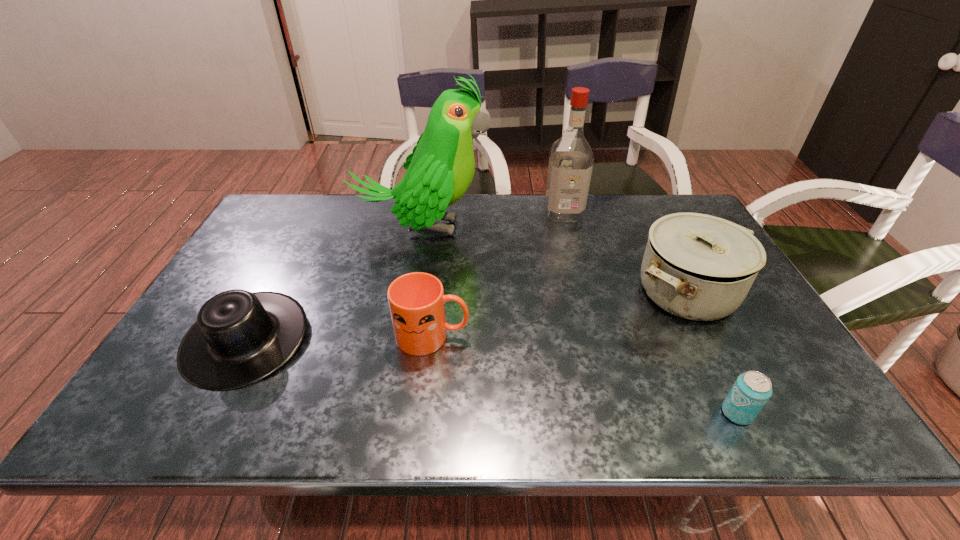
What are the coordinates of `free space located on the handle side of the mug` in the screenshot? It's located at (587, 336).

The image size is (960, 540). Identify the location of blank space located 0.280m on the right of the leftmost object. (424, 339).

Find the location of a particular element. free region located 0.160m on the left of the beer can is located at coordinates (644, 413).

Identify the location of parakeet at the far edge. (440, 169).

In order to click on liquor present at the far edge in this screenshot , I will do `click(571, 159)`.

Find the location of a particular element. Image resolution: width=960 pixels, height=540 pixels. object situated at the near edge is located at coordinates (750, 392).

Identify the location of object that is at the left edge. (240, 337).

Where is `saucepan that is at the right edge`? This screenshot has width=960, height=540. saucepan that is at the right edge is located at coordinates (696, 266).

Locate an element on the screen. Image resolution: width=960 pixels, height=540 pixels. beer can present at the right edge is located at coordinates (750, 392).

In order to click on object present at the near right corner in this screenshot , I will do (x=750, y=392).